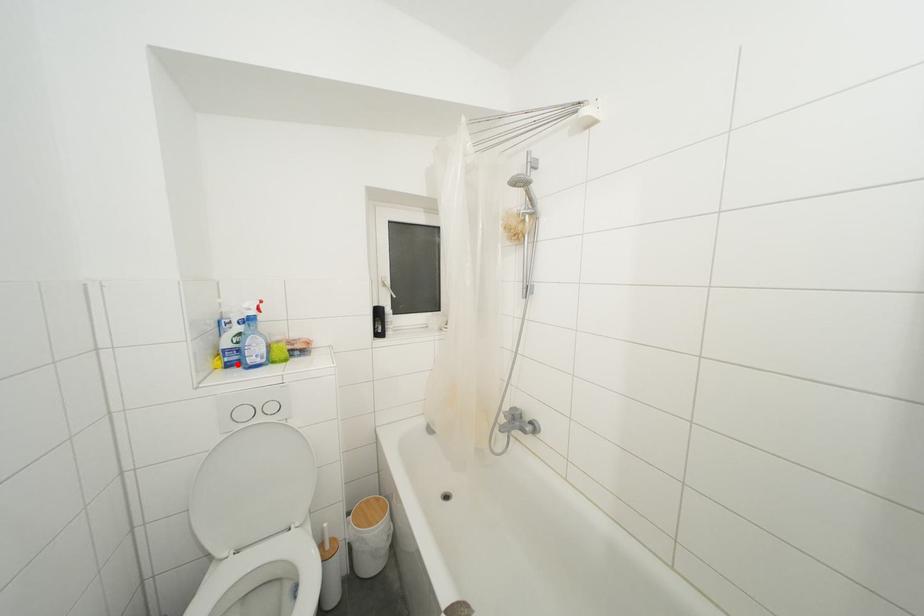
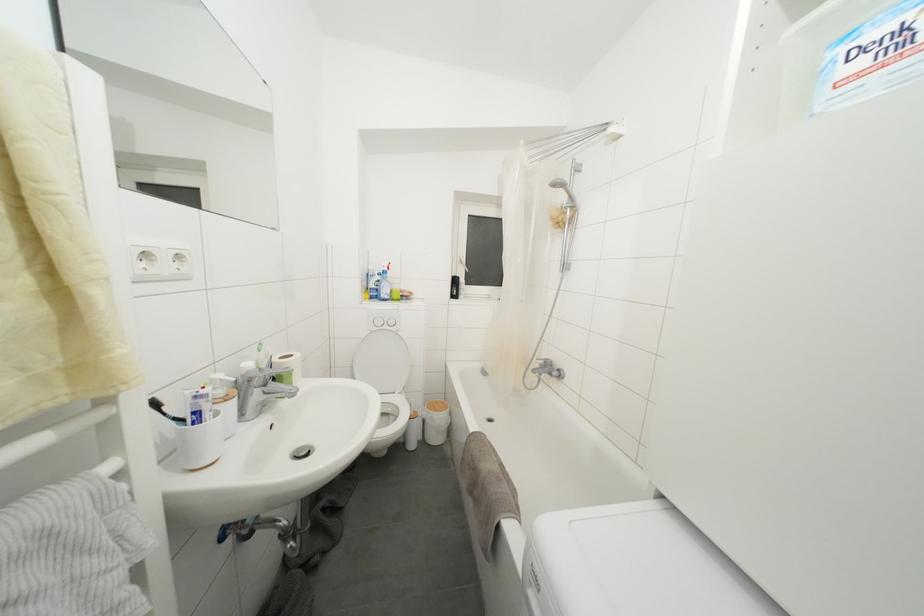
Where in the second image is the point corresponding to the highlighted location from the first image?

(379, 300)